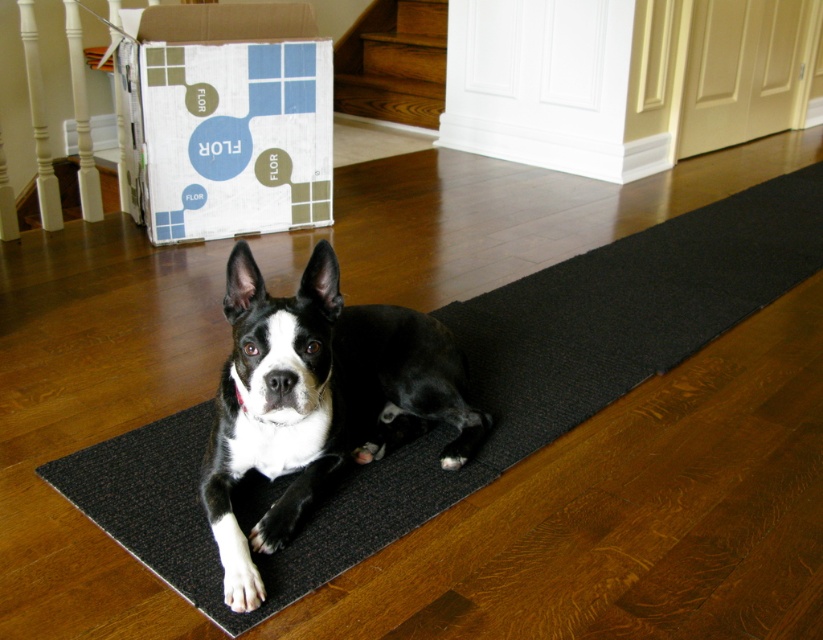
Does black rubber mat at center have a lesser height compared to white cardboard box at upper left?

No, black rubber mat at center is not shorter than white cardboard box at upper left.

Can you confirm if black rubber mat at center is thinner than white cardboard box at upper left?

In fact, black rubber mat at center might be wider than white cardboard box at upper left.

Does point (687, 243) come farther from viewer compared to point (156, 172)?

Yes, point (687, 243) is behind point (156, 172).

Image resolution: width=823 pixels, height=640 pixels. Find the location of `black rubber mat at center`. black rubber mat at center is located at coordinates (473, 390).

Between black matte dog at center and white cardboard box at upper left, which one appears on the right side from the viewer's perspective?

black matte dog at center is more to the right.

Who is higher up, black matte dog at center or white cardboard box at upper left?

white cardboard box at upper left is higher up.

This screenshot has height=640, width=823. Identify the location of black matte dog at center. (319, 401).

Is point (281, 556) in front of point (277, 356)?

No, it is behind (277, 356).

Which of these two, black rubber mat at center or black matte dog at center, stands shorter?

black matte dog at center

Does point (482, 323) come in front of point (261, 580)?

No.

Identify the location of black rubber mat at center. (473, 390).